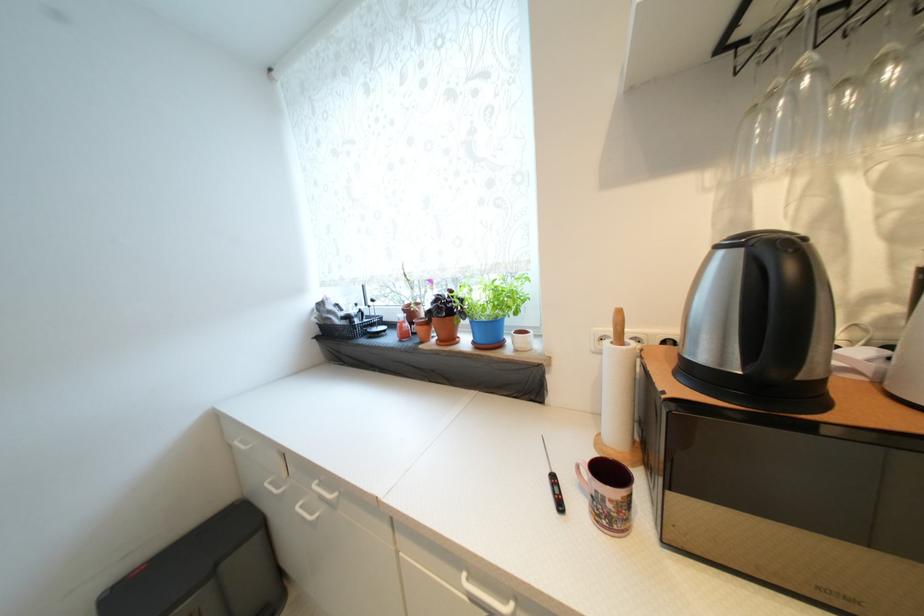
The image size is (924, 616). What do you see at coordinates (797, 300) in the screenshot?
I see `a black kettle handle` at bounding box center [797, 300].